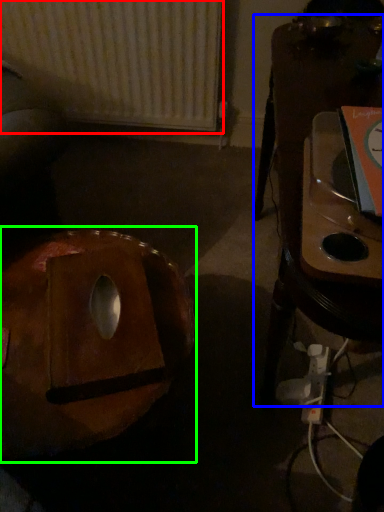
Question: Based on their relative distances, which object is farther from radiator (highlighted by a red box)? Choose from furniture (highlighted by a blue box) and bean bag chair (highlighted by a green box).

Choices:
 (A) furniture
 (B) bean bag chair

Answer: (B)